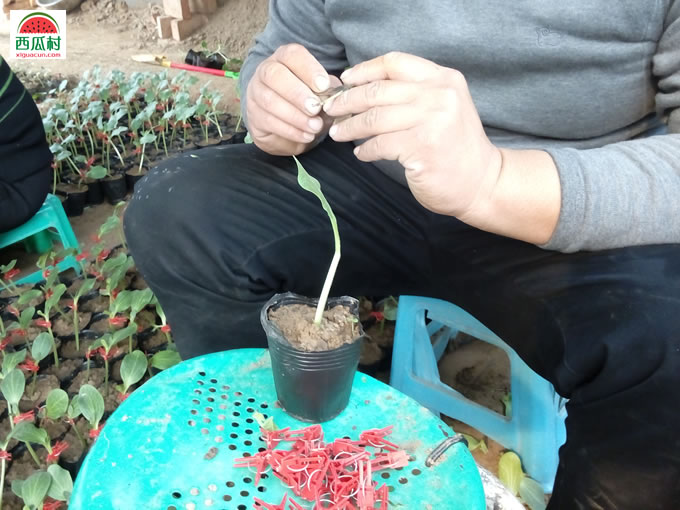
Locate an element on the screen. The height and width of the screenshot is (510, 680). pot is located at coordinates (296, 381).